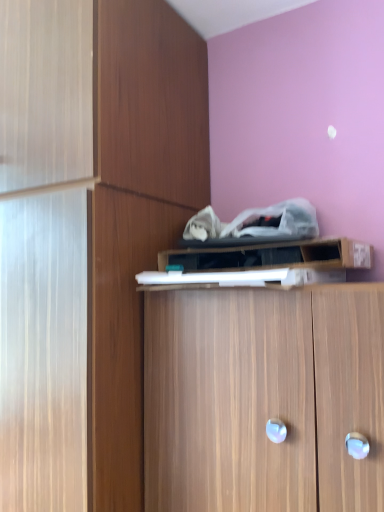
Question: Is wooden cabinet at center, the 3th cabinetry in the top-to-bottom sequence, in front of or behind wooden cabinet at upper center, placed as the first cabinetry when sorted from top to bottom, in the image?

Choices:
 (A) behind
 (B) front

Answer: (B)

Question: Would you say wooden cabinet at center, the 1th cabinetry ordered from the bottom, is inside or outside wooden cabinet at upper center, placed as the first cabinetry when sorted from top to bottom?

Choices:
 (A) outside
 (B) inside

Answer: (A)

Question: Which of these objects is positioned farthest from the wooden cabinet at upper center, placed as the first cabinetry when sorted from top to bottom?

Choices:
 (A) wooden cabinet at center, which is counted as the 2th cabinetry, starting from the top
 (B) wooden cabinet at center, the 3th cabinetry in the top-to-bottom sequence

Answer: (A)

Question: Which object is positioned farthest from the wooden cabinet at upper center, placed as the first cabinetry when sorted from top to bottom?

Choices:
 (A) wooden cabinet at center, the 1th cabinetry ordered from the bottom
 (B) wooden cabinet at center, arranged as the 2th cabinetry when ordered from the bottom

Answer: (B)